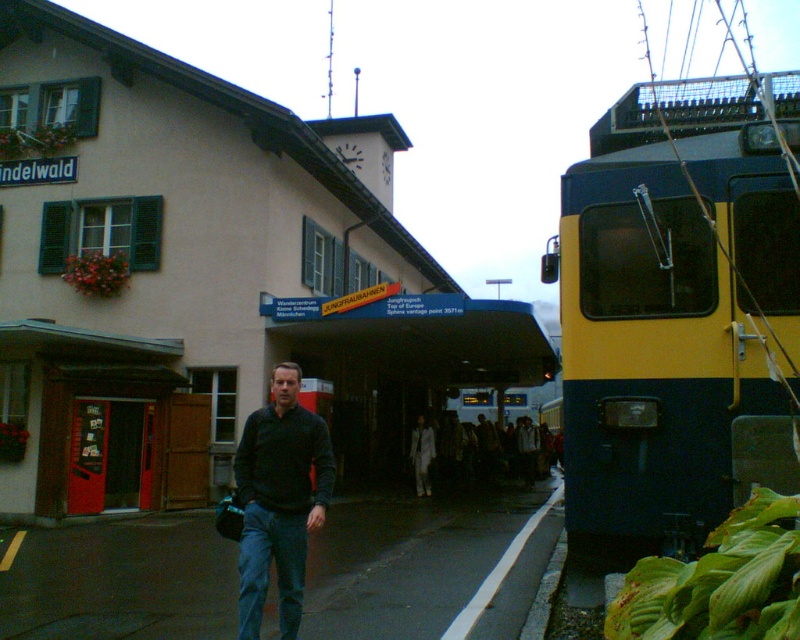
You are a station staff member who needs to park a new train that is 10 meters wide. There is space between the two trains mentioned. Can you fit the new train between the yellow metal train at right and the yellow and blue train at right based on their widths?

The yellow metal train at right might be wider than yellow and blue train at right, so it is uncertain whether the combined width of both trains would leave enough space for the new 10 meter wide train. More information about their exact widths is needed to determine this.

You are a passenger waiting at the Indelwald railway station. You notice a yellow and blue train at right and a black matte sweater at center. Which object is wider?

The yellow and blue train at right is wider than the black matte sweater at center according to the description.

You are a passenger at the Indelwald railway station and you see both the yellow metal train at right and the yellow and blue train at right. Which train is closer to the platform entrance located at the left side of the station?

The yellow metal train at right is closer to the platform entrance located at the left side of the station because it is positioned to the left of the yellow and blue train at right.